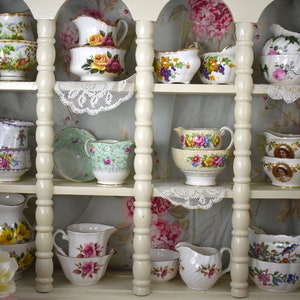
The image size is (300, 300). I want to click on cupboard, so click(x=125, y=294).